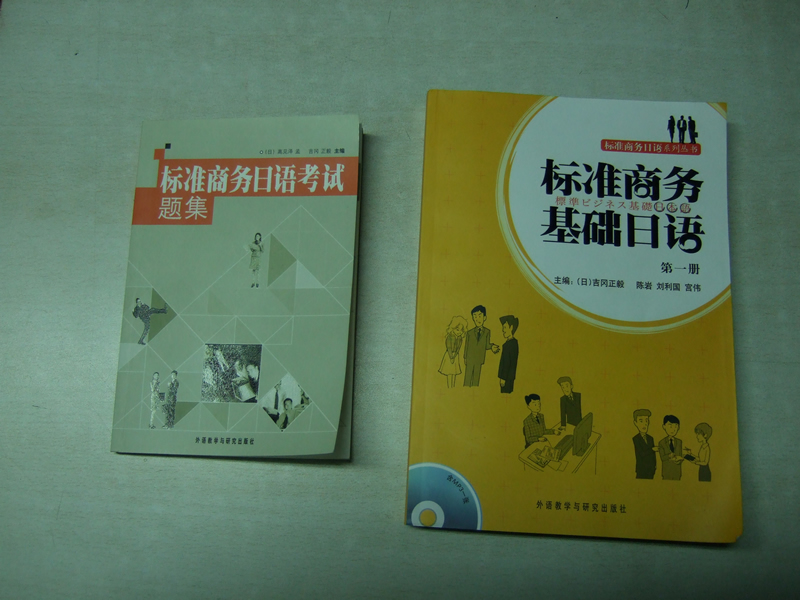
Where is `space between books`? This screenshot has width=800, height=600. space between books is located at coordinates (386, 296).